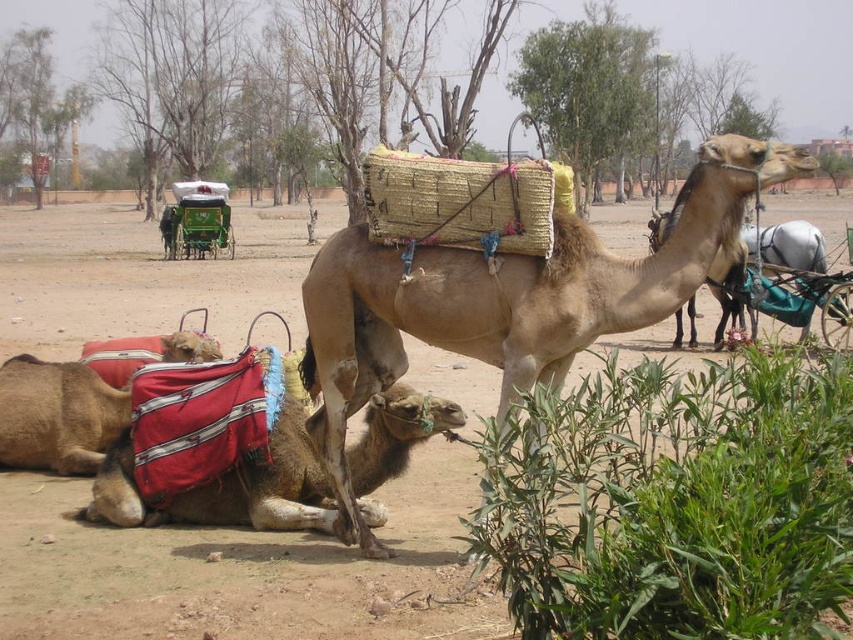
Is light brown camel at center taller than red fabric camel at lower left?

Yes.

Is light brown camel at center positioned behind red fabric camel at lower left?

No, it is not.

Does point (773, 156) lie behind point (207, 500)?

No, it is not.

You are a GUI agent. You are given a task and a screenshot of the screen. Output one action in this format:
    pyautogui.click(x=<x>, y=<y>)
    Task: Click on the light brown camel at center
    Image resolution: width=853 pixels, height=640 pixels.
    Given the screenshot: What is the action you would take?
    pyautogui.click(x=509, y=298)

How far apart are brown dirt field at center and red fabric camel at lower left?

13.22 meters

Can you confirm if brown dirt field at center is smaller than red fabric camel at lower left?

No.

Locate an element on the screen. This screenshot has height=640, width=853. brown dirt field at center is located at coordinates (244, 570).

The height and width of the screenshot is (640, 853). Identify the location of brown dirt field at center. (244, 570).

Consider the image. Between brown dirt field at center and light brown camel at center, which one is positioned lower?

light brown camel at center is below.

Does brown dirt field at center have a lesser width compared to light brown camel at center?

Incorrect, brown dirt field at center's width is not less than light brown camel at center's.

Is point (32, 531) farther from viewer compared to point (323, 440)?

Yes, it is.

Locate an element on the screen. The image size is (853, 640). brown dirt field at center is located at coordinates (244, 570).